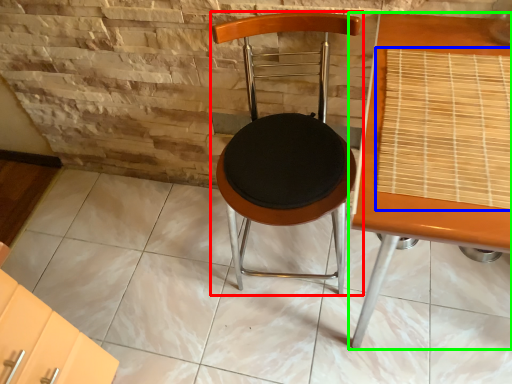
Question: Based on their relative distances, which object is nearer to chair (highlighted by a red box)? Choose from mat (highlighted by a blue box) and table (highlighted by a green box).

Choices:
 (A) mat
 (B) table

Answer: (B)